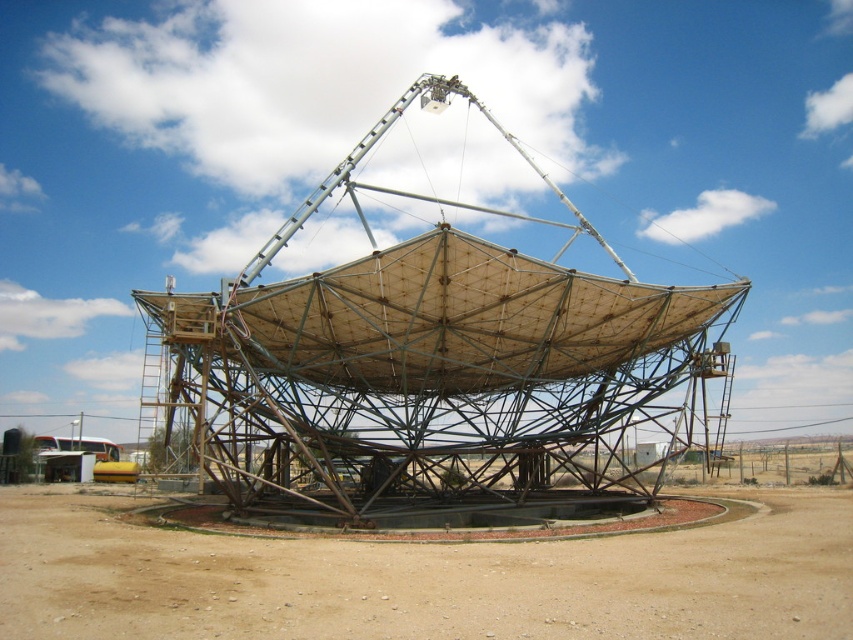
Question: From the image, what is the correct spatial relationship of metallic satellite dish at center in relation to brown sandy dirt at center?

Choices:
 (A) below
 (B) above

Answer: (B)

Question: Can you confirm if metallic satellite dish at center is positioned below brown sandy dirt at center?

Choices:
 (A) yes
 (B) no

Answer: (B)

Question: Is metallic satellite dish at center to the right of brown sandy dirt at center from the viewer's perspective?

Choices:
 (A) yes
 (B) no

Answer: (B)

Question: Which point is farther to the camera?

Choices:
 (A) (131, 624)
 (B) (206, 456)

Answer: (B)